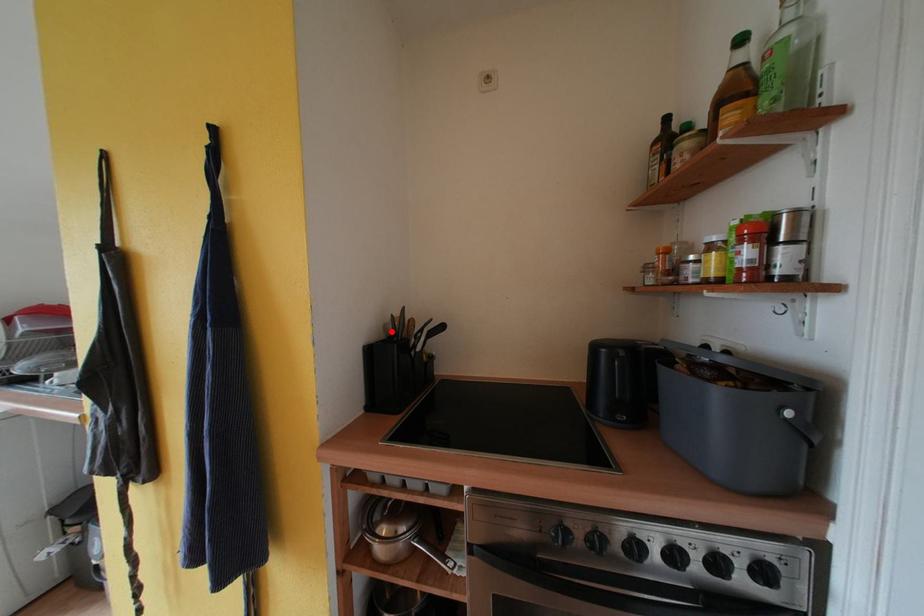
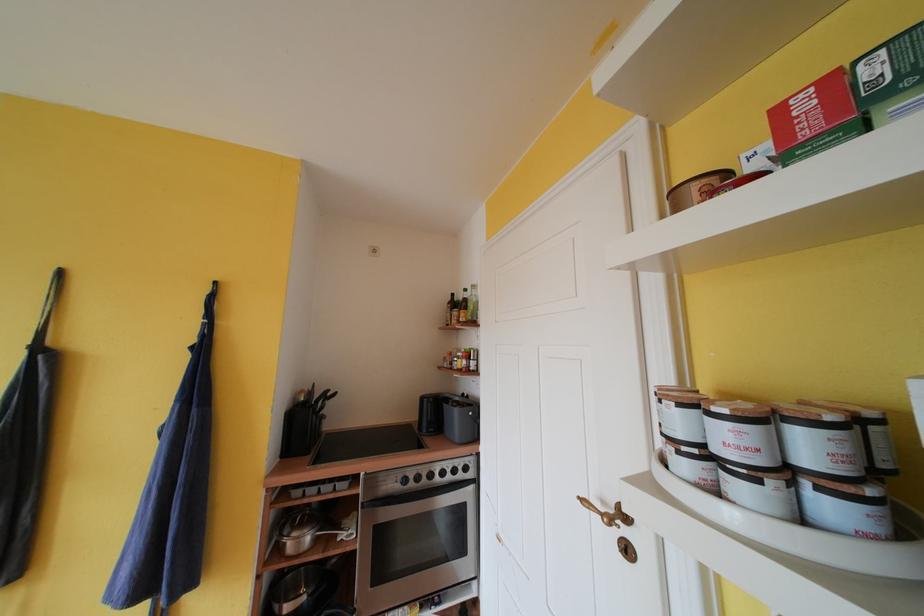
The point at the highlighted location is marked in the first image. Where is the corresponding point in the second image?

(301, 402)